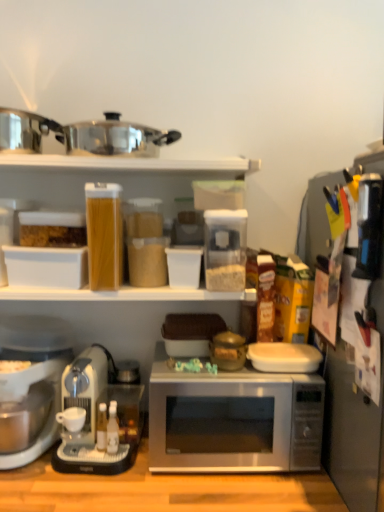
Question: Is black plastic knife block at right, the second appliance positioned from the left, oriented away from black plastic knife block at right, marked as the first appliance in a right-to-left arrangement?

Choices:
 (A) yes
 (B) no

Answer: (A)

Question: Is black plastic knife block at right, marked as the 2th appliance in a right-to-left arrangement, to the right of black plastic knife block at right, marked as the first appliance in a right-to-left arrangement, from the viewer's perspective?

Choices:
 (A) no
 (B) yes

Answer: (A)

Question: Is black plastic knife block at right, the second appliance positioned from the left, taller than black plastic knife block at right, marked as the 3th appliance in a left-to-right arrangement?

Choices:
 (A) no
 (B) yes

Answer: (A)

Question: Is there a large distance between black plastic knife block at right, marked as the 2th appliance in a right-to-left arrangement, and black plastic knife block at right, marked as the first appliance in a right-to-left arrangement?

Choices:
 (A) yes
 (B) no

Answer: (B)

Question: From a real-world perspective, is black plastic knife block at right, marked as the 2th appliance in a right-to-left arrangement, located higher than black plastic knife block at right, marked as the 3th appliance in a left-to-right arrangement?

Choices:
 (A) yes
 (B) no

Answer: (A)

Question: Is silver metallic microwave at center in front of or behind white matte coffee cup at lower left in the image?

Choices:
 (A) front
 (B) behind

Answer: (A)

Question: Is silver metallic microwave at center taller or shorter than white matte coffee cup at lower left?

Choices:
 (A) tall
 (B) short

Answer: (A)

Question: From the image's perspective, is silver metallic microwave at center above or below white matte coffee cup at lower left?

Choices:
 (A) below
 (B) above

Answer: (B)

Question: Is silver metallic microwave at center wider or thinner than white matte coffee cup at lower left?

Choices:
 (A) wide
 (B) thin

Answer: (A)

Question: Considering their positions, is white plastic coffee maker at lower left, which is the 1th coffee maker from left to right, located in front of or behind black plastic knife block at right, marked as the first appliance in a right-to-left arrangement?

Choices:
 (A) front
 (B) behind

Answer: (B)

Question: Would you say white plastic coffee maker at lower left, which is the 1th coffee maker from left to right, is inside or outside black plastic knife block at right, marked as the 3th appliance in a left-to-right arrangement?

Choices:
 (A) outside
 (B) inside

Answer: (A)

Question: Considering the positions of point (41, 369) and point (354, 418), is point (41, 369) closer or farther from the camera than point (354, 418)?

Choices:
 (A) closer
 (B) farther

Answer: (B)

Question: Considering the positions of white plastic coffee maker at lower left, which is the 1th coffee maker from left to right, and black plastic knife block at right, marked as the 3th appliance in a left-to-right arrangement, in the image, is white plastic coffee maker at lower left, which is the 1th coffee maker from left to right, wider or thinner than black plastic knife block at right, marked as the 3th appliance in a left-to-right arrangement,?

Choices:
 (A) wide
 (B) thin

Answer: (A)

Question: Is black plastic knife block at right, marked as the 2th appliance in a right-to-left arrangement, wider or thinner than white matte coffee cup at lower left?

Choices:
 (A) thin
 (B) wide

Answer: (A)

Question: From the image's perspective, is black plastic knife block at right, the second appliance positioned from the left, above or below white matte coffee cup at lower left?

Choices:
 (A) above
 (B) below

Answer: (A)